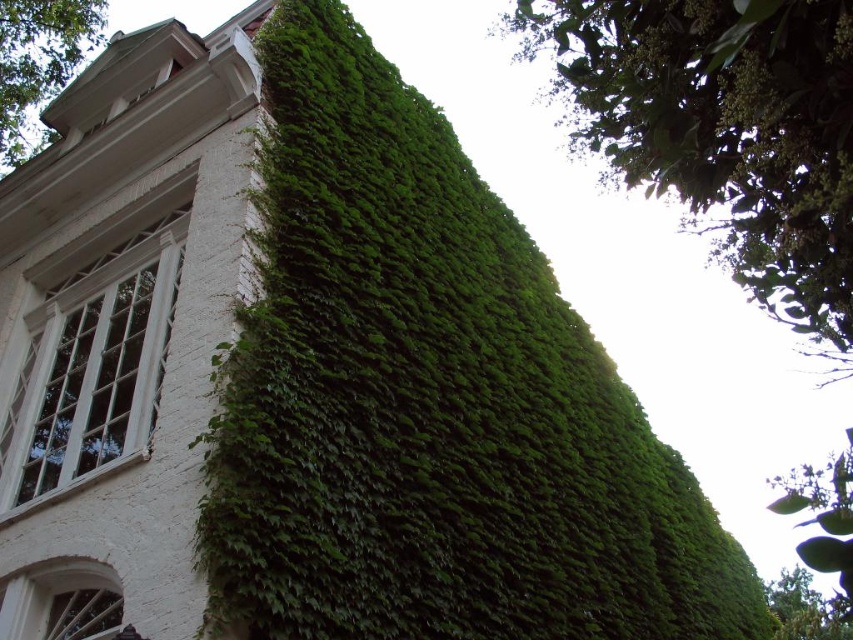
Which of these two, green leafy tree at upper right or white glass window at lower left, stands taller?

With more height is green leafy tree at upper right.

Does green leafy tree at upper right appear over white glass window at lower left?

Correct, green leafy tree at upper right is located above white glass window at lower left.

What do you see at coordinates (724, 131) in the screenshot? This screenshot has height=640, width=853. I see `green leafy tree at upper right` at bounding box center [724, 131].

You are a GUI agent. You are given a task and a screenshot of the screen. Output one action in this format:
    pyautogui.click(x=<x>, y=<y>)
    Task: Click on the green leafy tree at upper right
    The width and height of the screenshot is (853, 640).
    Given the screenshot: What is the action you would take?
    pyautogui.click(x=724, y=131)

Can you confirm if white painted wood window at left is wider than green leafy ivy at upper left?

No.

You are a GUI agent. You are given a task and a screenshot of the screen. Output one action in this format:
    pyautogui.click(x=<x>, y=<y>)
    Task: Click on the white painted wood window at left
    This screenshot has width=853, height=640.
    Given the screenshot: What is the action you would take?
    pyautogui.click(x=91, y=369)

Which is in front, point (38, 70) or point (54, 572)?

Point (54, 572)

From the picture: Can you confirm if green leafy ivy at upper left is positioned to the left of white glass window at lower left?

Indeed, green leafy ivy at upper left is positioned on the left side of white glass window at lower left.

This screenshot has height=640, width=853. Describe the element at coordinates (39, 61) in the screenshot. I see `green leafy ivy at upper left` at that location.

Image resolution: width=853 pixels, height=640 pixels. I want to click on green leafy ivy at upper left, so click(39, 61).